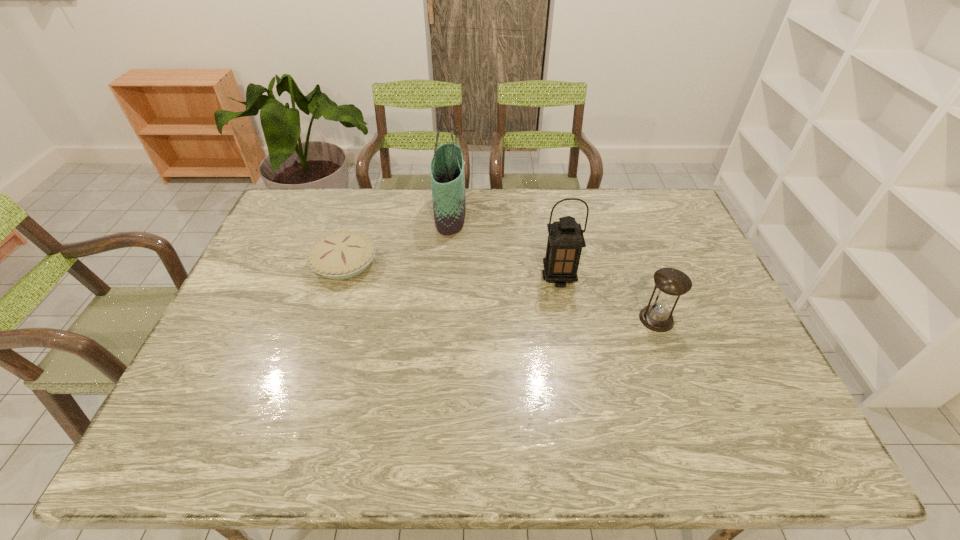
Where is `free spot between the hourglass and the shortest object`? This screenshot has height=540, width=960. free spot between the hourglass and the shortest object is located at coordinates (501, 291).

Find the location of a particular element. vacant space that is in between the second object from right to left and the nearest object is located at coordinates (608, 299).

Locate an element on the screen. The image size is (960, 540). vacant area that lies between the shortest object and the farthest object is located at coordinates 397,238.

Identify the location of empty space that is in between the third shortest object and the tote bag. The image size is (960, 540). (504, 246).

The width and height of the screenshot is (960, 540). Identify the location of free space between the pie and the tote bag. (397, 238).

You are a GUI agent. You are given a task and a screenshot of the screen. Output one action in this format:
    pyautogui.click(x=<x>, y=<y>)
    Task: Click on the free spot between the leftmost object and the third shortest object
    
    Given the screenshot: What is the action you would take?
    pyautogui.click(x=452, y=271)

Where is `vacant space that is in between the hourglass and the pie`? The width and height of the screenshot is (960, 540). vacant space that is in between the hourglass and the pie is located at coordinates (501, 291).

You are a GUI agent. You are given a task and a screenshot of the screen. Output one action in this format:
    pyautogui.click(x=<x>, y=<y>)
    Task: Click on the free point between the second tallest object and the third tallest object
    
    Given the screenshot: What is the action you would take?
    pyautogui.click(x=608, y=299)

Identify the location of vacant space that is in between the farthest object and the second object from right to left. This screenshot has width=960, height=540. (504, 246).

At what (x,y) coordinates should I click in order to perform the action: click on the third closest object to the leftmost object. Please return your answer as a coordinate pair (x, y). This screenshot has height=540, width=960. Looking at the image, I should click on (671, 283).